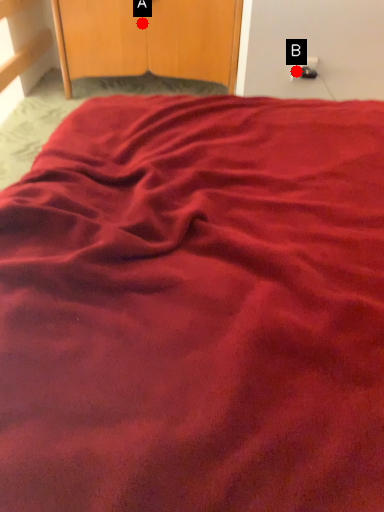
Question: Two points are circled on the image, labeled by A and B beside each circle. Which point is farther from the camera taking this photo?

Choices:
 (A) A is further
 (B) B is further

Answer: (A)